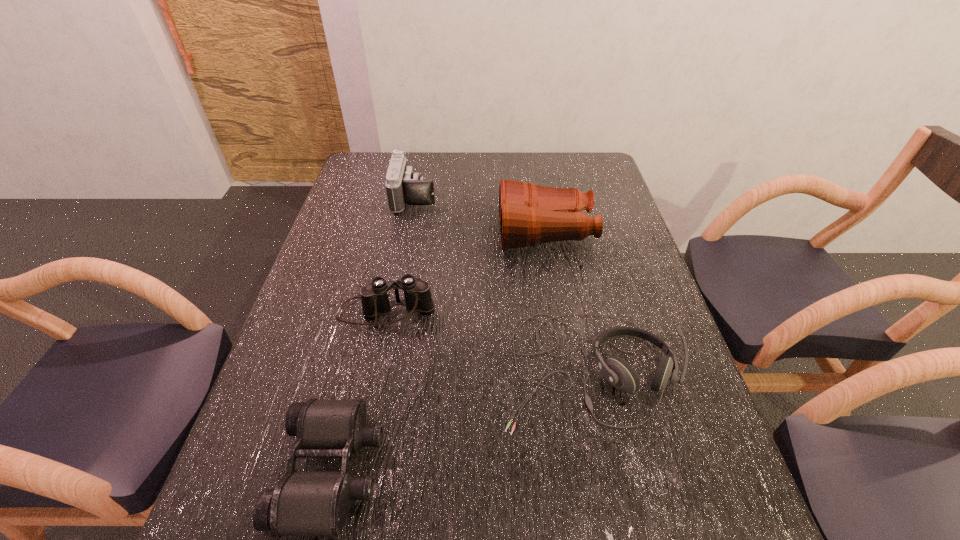
This screenshot has height=540, width=960. I want to click on vacant area that lies between the camera and the tallest binoculars, so point(480,214).

Where is `free point between the farthest binoculars and the camera`? The width and height of the screenshot is (960, 540). free point between the farthest binoculars and the camera is located at coordinates point(480,214).

At what (x,y) coordinates should I click in order to perform the action: click on vacant area between the camera and the second shortest object. Please return your answer as a coordinate pair (x, y). Looking at the image, I should click on (502, 283).

The width and height of the screenshot is (960, 540). Identify the location of vacant point located between the camera and the second tallest binoculars. (400, 255).

Where is `empty location between the rightmost binoculars and the fourth tallest object`? Image resolution: width=960 pixels, height=540 pixels. empty location between the rightmost binoculars and the fourth tallest object is located at coordinates (567, 300).

The height and width of the screenshot is (540, 960). Identify the location of object that ranks as the second closest to the second nearest binoculars. (304, 503).

Locate an element on the screen. The width and height of the screenshot is (960, 540). object that is the fourth closest to the fourth tallest object is located at coordinates (403, 185).

Locate an element on the screen. This screenshot has height=540, width=960. binoculars identified as the closest to the headset is located at coordinates (374, 297).

Identify the location of the closest binoculars to the nearest binoculars. (374, 297).